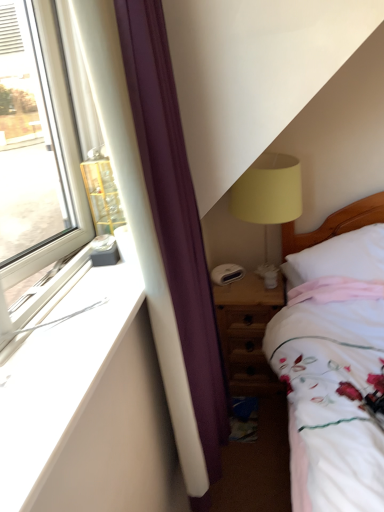
The height and width of the screenshot is (512, 384). I want to click on blank space above white smooth window sill at left (from a real-world perspective), so click(76, 316).